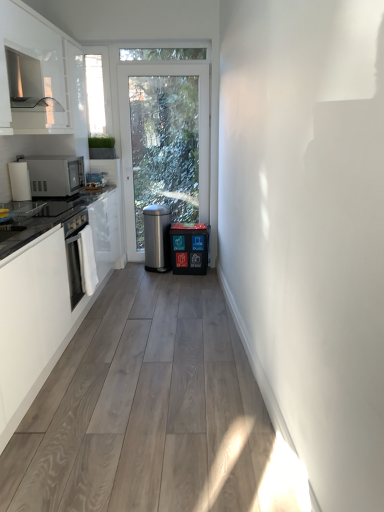
Question: Is satin silver microwave at left bigger than transparent glass window at upper left?

Choices:
 (A) yes
 (B) no

Answer: (A)

Question: Can you confirm if satin silver microwave at left is smaller than transparent glass window at upper left?

Choices:
 (A) no
 (B) yes

Answer: (A)

Question: Can you see satin silver microwave at left touching transparent glass window at upper left?

Choices:
 (A) yes
 (B) no

Answer: (B)

Question: From the image's perspective, is satin silver microwave at left located above transparent glass window at upper left?

Choices:
 (A) no
 (B) yes

Answer: (A)

Question: From the image's perspective, is satin silver microwave at left below transparent glass window at upper left?

Choices:
 (A) yes
 (B) no

Answer: (A)

Question: From the image's perspective, relative to transparent glass window at upper left, is white glossy cabinet at upper left, which is the 1th cabinetry in top-to-bottom order, above or below?

Choices:
 (A) above
 (B) below

Answer: (B)

Question: In the image, is white glossy cabinet at upper left, marked as the second cabinetry in a bottom-to-top arrangement, on the left side or the right side of transparent glass window at upper left?

Choices:
 (A) left
 (B) right

Answer: (A)

Question: In terms of width, does white glossy cabinet at upper left, marked as the second cabinetry in a bottom-to-top arrangement, look wider or thinner when compared to transparent glass window at upper left?

Choices:
 (A) thin
 (B) wide

Answer: (B)

Question: From a real-world perspective, is white glossy cabinet at upper left, which is the 1th cabinetry in top-to-bottom order, above or below transparent glass window at upper left?

Choices:
 (A) below
 (B) above

Answer: (B)

Question: Considering the positions of point (177, 224) and point (34, 309), is point (177, 224) closer or farther from the camera than point (34, 309)?

Choices:
 (A) closer
 (B) farther

Answer: (B)

Question: Is metallic silver dishwasher at center in front of or behind white matte cabinet at left, the first cabinetry from the bottom, in the image?

Choices:
 (A) behind
 (B) front

Answer: (A)

Question: Is metallic silver dishwasher at center wider or thinner than white matte cabinet at left, the first cabinetry from the bottom?

Choices:
 (A) thin
 (B) wide

Answer: (A)

Question: From the image's perspective, relative to white matte cabinet at left, the first cabinetry from the bottom, is metallic silver dishwasher at center above or below?

Choices:
 (A) below
 (B) above

Answer: (B)

Question: Considering the positions of white matte cabinet at left, the first cabinetry from the bottom, and metallic silver dishwasher at center in the image, is white matte cabinet at left, the first cabinetry from the bottom, taller or shorter than metallic silver dishwasher at center?

Choices:
 (A) short
 (B) tall

Answer: (B)

Question: Considering the positions of point (44, 362) and point (173, 233), is point (44, 362) closer or farther from the camera than point (173, 233)?

Choices:
 (A) farther
 (B) closer

Answer: (B)